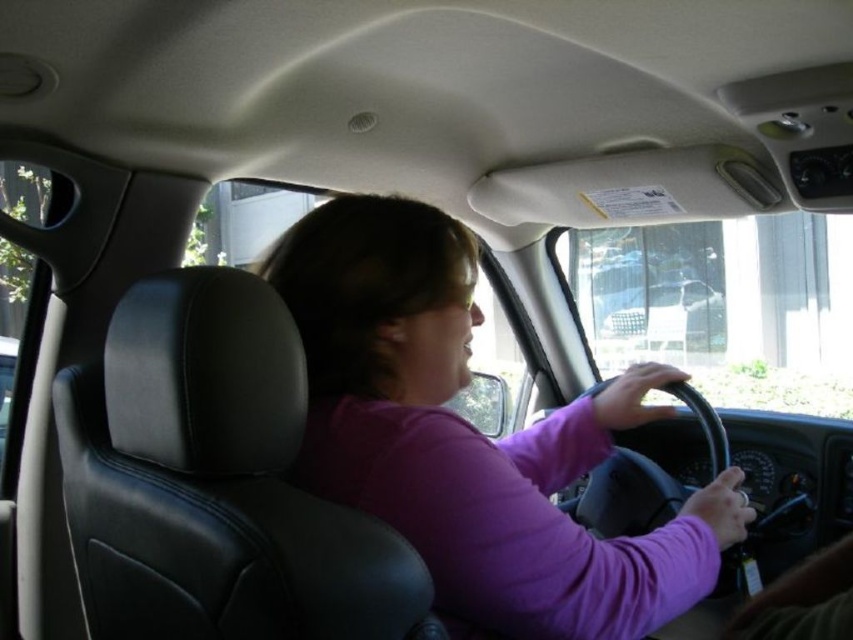
How distant is purple matte shirt at center from metallic silver car at center?

They are 4.94 meters apart.

Is purple matte shirt at center to the right of metallic silver car at center from the viewer's perspective?

No, purple matte shirt at center is not to the right of metallic silver car at center.

Which is in front, point (566, 589) or point (616, 330)?

Point (566, 589) is in front.

Locate an element on the screen. The width and height of the screenshot is (853, 640). purple matte shirt at center is located at coordinates (473, 438).